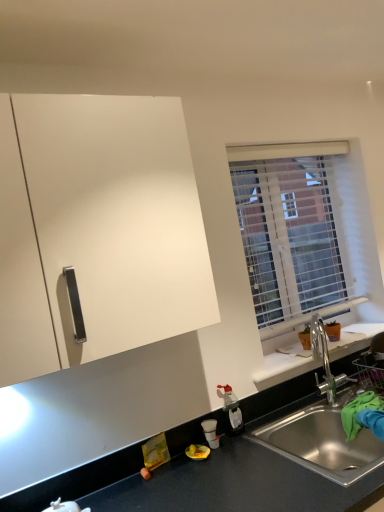
Question: From a real-world perspective, is white translucent blinds at upper right physically above matte black countertop at lower center?

Choices:
 (A) yes
 (B) no

Answer: (A)

Question: Is white translucent blinds at upper right facing towards matte black countertop at lower center?

Choices:
 (A) no
 (B) yes

Answer: (A)

Question: From a real-world perspective, is white translucent blinds at upper right positioned under matte black countertop at lower center based on gravity?

Choices:
 (A) yes
 (B) no

Answer: (B)

Question: Does white translucent blinds at upper right have a smaller size compared to matte black countertop at lower center?

Choices:
 (A) yes
 (B) no

Answer: (B)

Question: Is white translucent blinds at upper right far from matte black countertop at lower center?

Choices:
 (A) no
 (B) yes

Answer: (A)

Question: Based on their positions, is white translucent blinds at upper right located to the left or right of white matte cabinet at upper left?

Choices:
 (A) right
 (B) left

Answer: (A)

Question: Does point (263, 157) appear closer or farther from the camera than point (54, 219)?

Choices:
 (A) closer
 (B) farther

Answer: (B)

Question: From the image's perspective, is white translucent blinds at upper right above or below white matte cabinet at upper left?

Choices:
 (A) above
 (B) below

Answer: (A)

Question: From a real-world perspective, is white translucent blinds at upper right positioned above or below white matte cabinet at upper left?

Choices:
 (A) below
 (B) above

Answer: (A)

Question: Is white translucent blinds at upper right in front of or behind stainless steel sink at lower right in the image?

Choices:
 (A) behind
 (B) front

Answer: (A)

Question: Would you say white translucent blinds at upper right is to the left or to the right of stainless steel sink at lower right in the picture?

Choices:
 (A) left
 (B) right

Answer: (A)

Question: Is white translucent blinds at upper right wider or thinner than stainless steel sink at lower right?

Choices:
 (A) wide
 (B) thin

Answer: (B)

Question: From their relative heights in the image, would you say white translucent blinds at upper right is taller or shorter than stainless steel sink at lower right?

Choices:
 (A) tall
 (B) short

Answer: (A)

Question: From the image's perspective, is translucent plastic bottle at lower center positioned above or below white translucent blinds at upper right?

Choices:
 (A) below
 (B) above

Answer: (A)

Question: From a real-world perspective, relative to white translucent blinds at upper right, is translucent plastic bottle at lower center vertically above or below?

Choices:
 (A) above
 (B) below

Answer: (B)